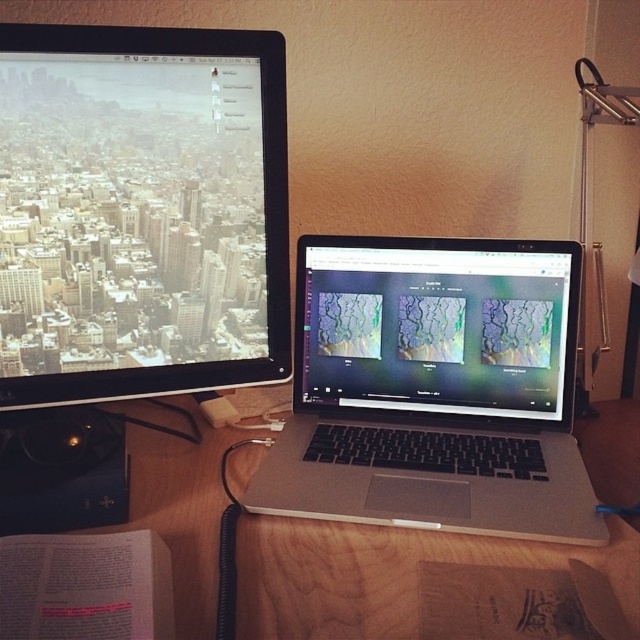
Between matte black monitor at upper left and wooden table at center, which one appears on the left side from the viewer's perspective?

Positioned to the left is matte black monitor at upper left.

Does matte black monitor at upper left have a smaller size compared to wooden table at center?

Yes, matte black monitor at upper left is smaller than wooden table at center.

I want to click on matte black monitor at upper left, so click(x=141, y=211).

Locate an element on the screen. The height and width of the screenshot is (640, 640). matte black monitor at upper left is located at coordinates (141, 211).

Identify the location of matte black monitor at upper left. (141, 211).

Is matte black monitor at upper left behind silver metallic laptop at center?

No.

Is point (134, 173) farther from camera compared to point (554, 289)?

No.

Locate an element on the screen. matte black monitor at upper left is located at coordinates click(x=141, y=211).

Can you confirm if silver metallic laptop at center is bigger than matte plastic laptop at center?

Correct, silver metallic laptop at center is larger in size than matte plastic laptop at center.

The height and width of the screenshot is (640, 640). Describe the element at coordinates (433, 388) in the screenshot. I see `silver metallic laptop at center` at that location.

Identify the location of silver metallic laptop at center. This screenshot has height=640, width=640. (433, 388).